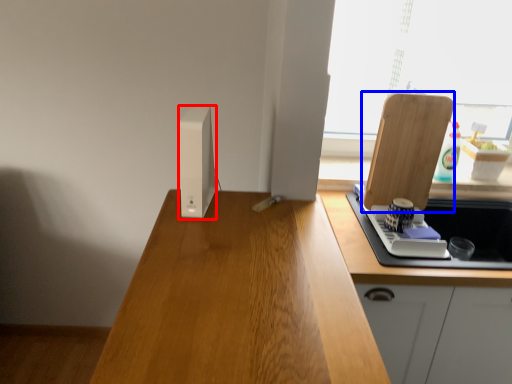
Question: Which of the following is the farthest to the observer, appliance (highlighted by a red box) or cutting board (highlighted by a blue box)?

Choices:
 (A) appliance
 (B) cutting board

Answer: (B)